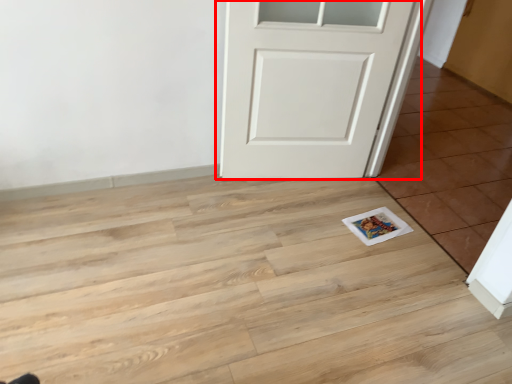
Question: From the image, what is the correct spatial relationship of door (annotated by the red box) in relation to tile?

Choices:
 (A) right
 (B) left

Answer: (B)